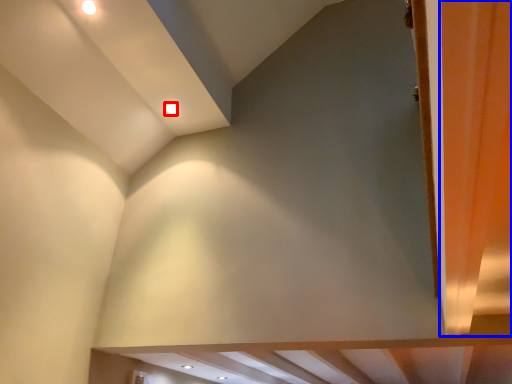
Question: Which of the following is the farthest to the observer, lighting (highlighted by a red box) or curtain (highlighted by a blue box)?

Choices:
 (A) lighting
 (B) curtain

Answer: (A)